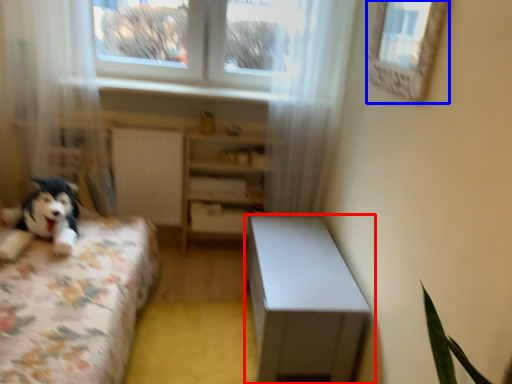
Question: Which object appears closest to the camera in this image, table (highlighted by a red box) or window (highlighted by a blue box)?

Choices:
 (A) table
 (B) window

Answer: (B)